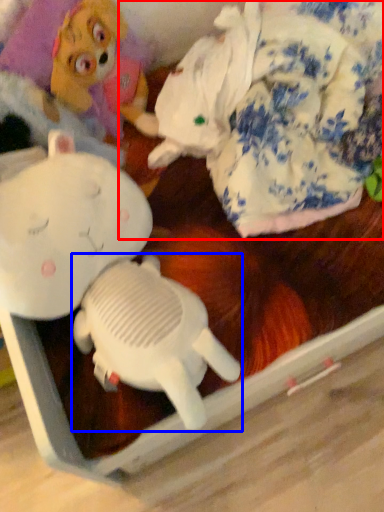
Question: Which point is closer to the camera, toy (highlighted by a red box) or toy (highlighted by a blue box)?

Choices:
 (A) toy
 (B) toy

Answer: (B)